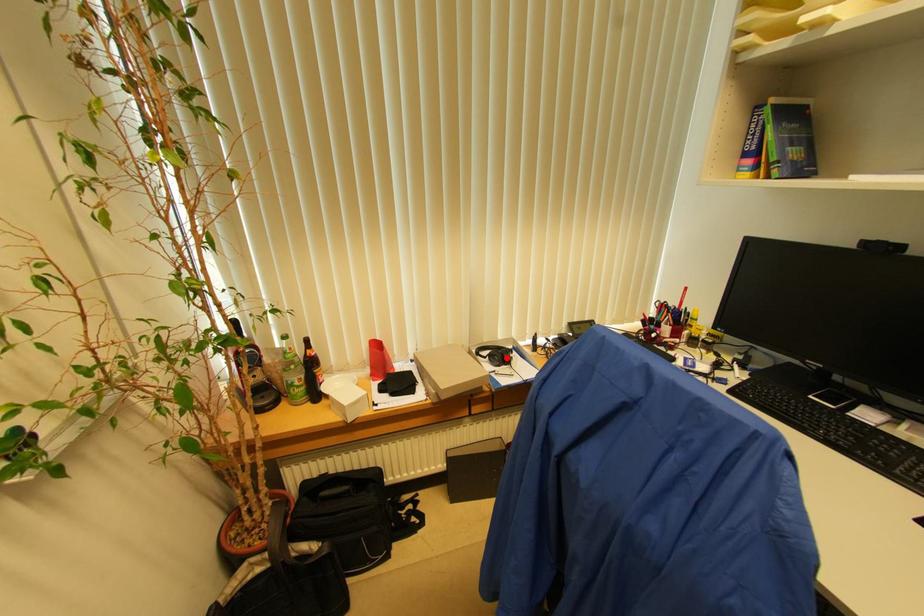
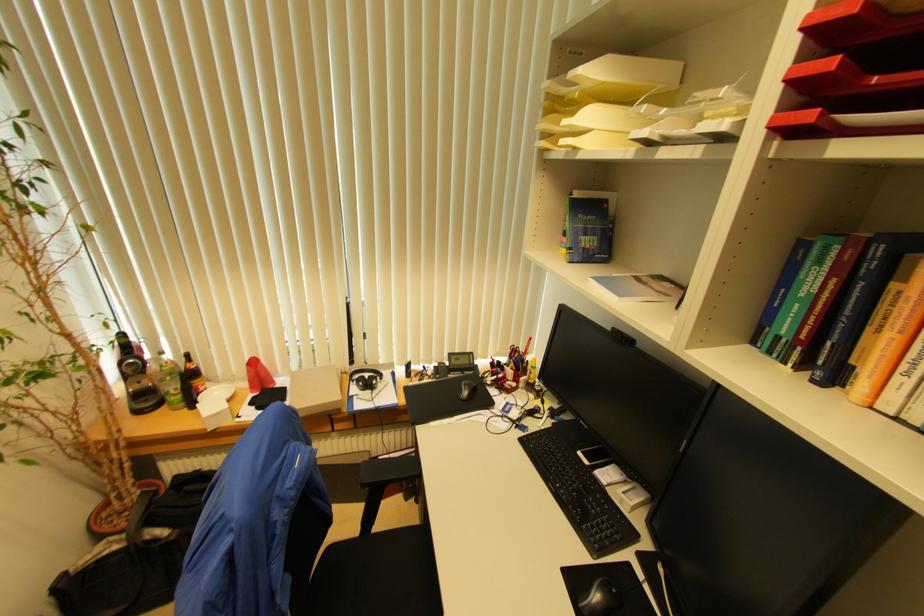
The point at the highlighted location is marked in the first image. Where is the corresponding point in the second image?

(371, 384)